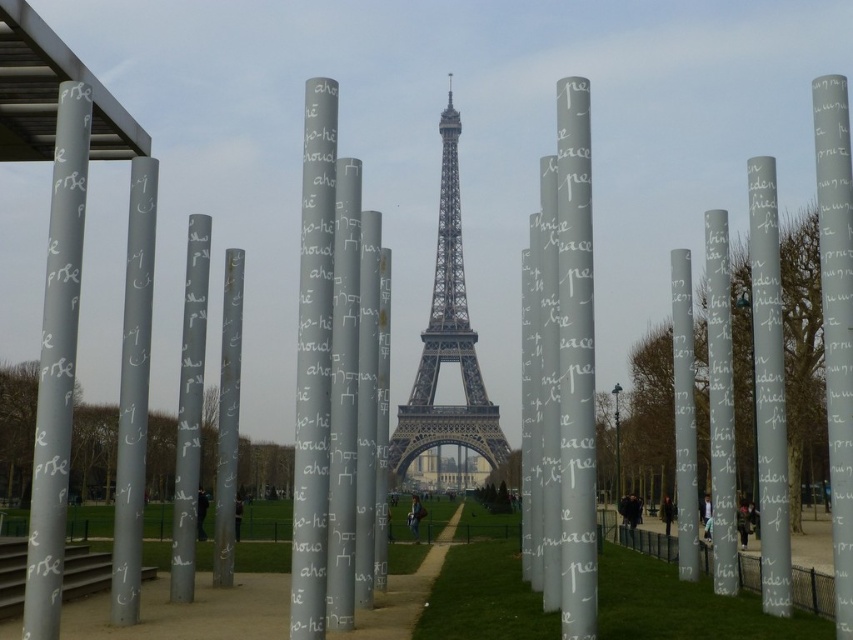
Question: Is smooth concrete path at center above gray metallic pole at center?

Choices:
 (A) no
 (B) yes

Answer: (A)

Question: Does silver metallic pillar at left have a lesser width compared to smooth concrete path at center?

Choices:
 (A) yes
 (B) no

Answer: (A)

Question: Which object is the closest to the silver metallic pillar at right?

Choices:
 (A) smooth concrete path at center
 (B) metallic silver eiffel tower at center

Answer: (B)

Question: Among these points, which one is farthest from the camera?

Choices:
 (A) (776, 269)
 (B) (848, 179)
 (C) (144, 227)

Answer: (A)

Question: Is silver metallic pillar at left in front of silver polished column at right?

Choices:
 (A) yes
 (B) no

Answer: (A)

Question: Which of the following is the farthest from the observer?

Choices:
 (A) (56, 257)
 (B) (825, 387)

Answer: (B)